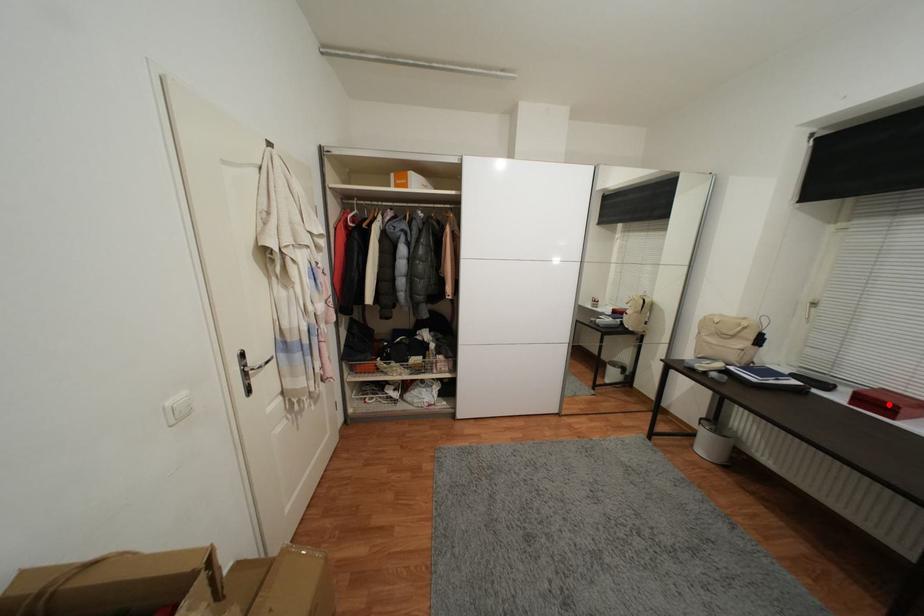
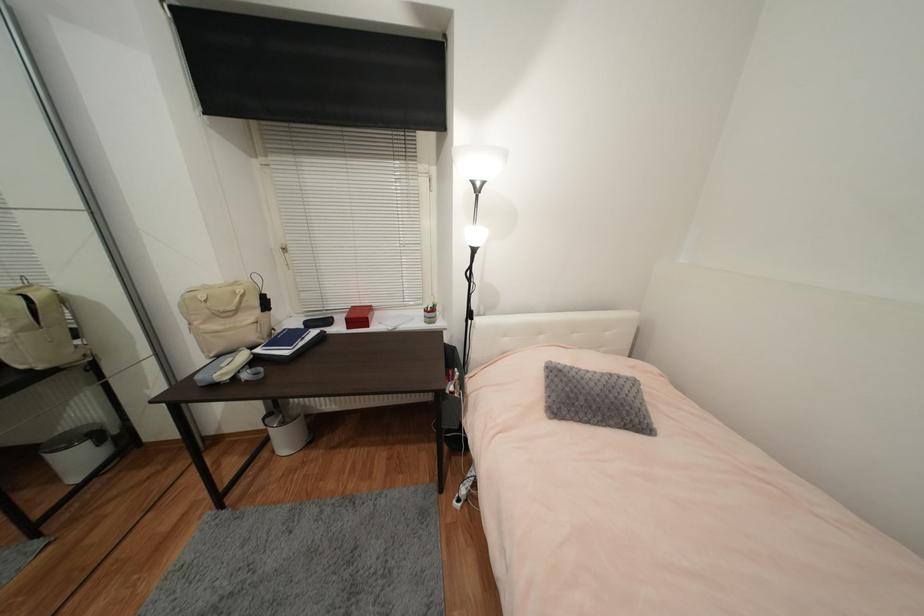
Find the pixel in the second image that matches the highlighted location in the first image.

(363, 318)